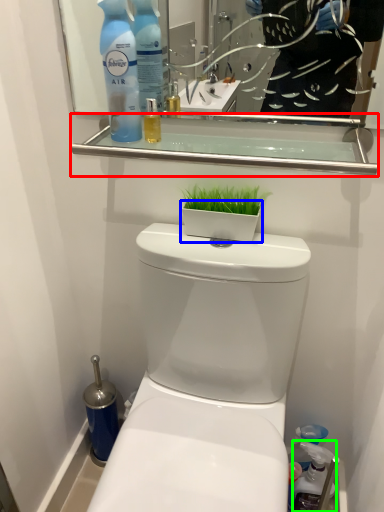
Question: Based on their relative distances, which object is nearer to balustrade (highlighted by a red box)? Choose from flowerpot (highlighted by a blue box) and cleaning product (highlighted by a green box).

Choices:
 (A) flowerpot
 (B) cleaning product

Answer: (A)